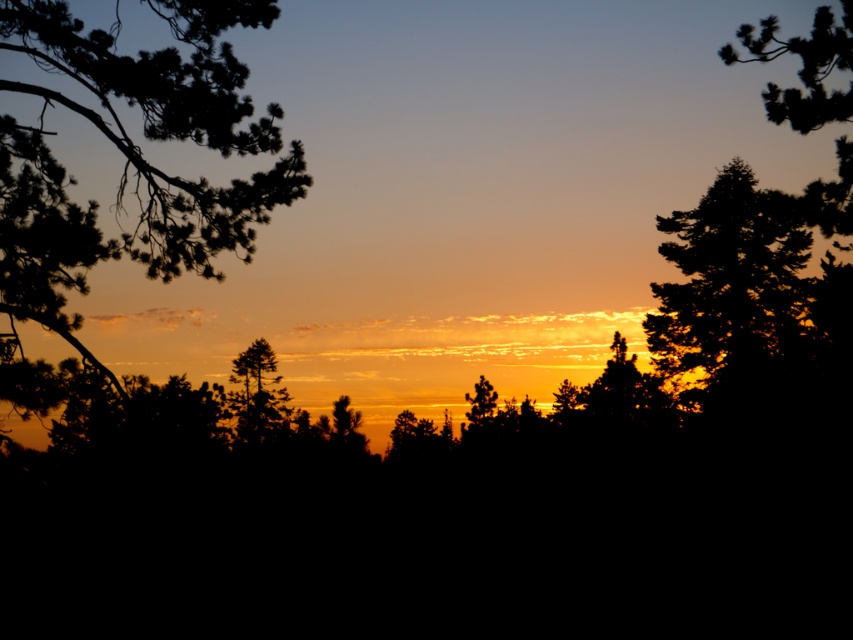
You are an artist trying to paint the sunset scene. You want to ensure the silhouette branch at left and the silhouette pine tree at center are proportionally accurate. Which object should you make narrower in your painting?

The silhouette branch at left should be narrower than the silhouette pine tree at center because the silhouette branch at left has a smaller width compared to the silhouette pine tree at center.

You are standing in the sunset scene and want to touch the silhouette branch at left. Where should you look to find it?

The silhouette branch at left is located at point 0.242 on the x axis and 0.156 on the y axis.

You are an artist trying to paint this sunset scene. You have two brushes available. One is 2 inches wide for the silhouette branch at left, and the other is 3 inches wide for the dark green textured pine tree at upper right. Which brush should you use for each object to match their actual widths?

The silhouette branch at left is narrower than the dark green textured pine tree at upper right, so use the 2 inch brush for the silhouette branch at left and the 3 inch brush for the dark green textured pine tree at upper right.